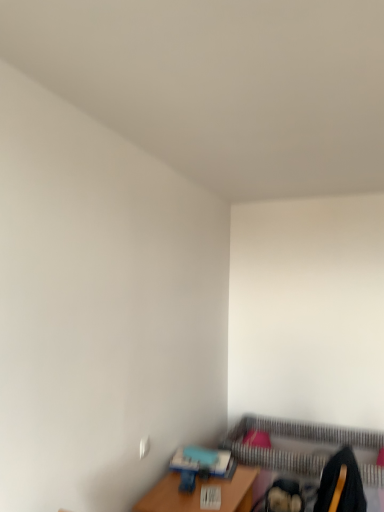
Question: Is wooden table at lower right shorter than striped fabric bed frame at lower right?

Choices:
 (A) no
 (B) yes

Answer: (B)

Question: Is wooden table at lower right next to striped fabric bed frame at lower right and touching it?

Choices:
 (A) no
 (B) yes

Answer: (A)

Question: Does wooden table at lower right have a larger size compared to striped fabric bed frame at lower right?

Choices:
 (A) yes
 (B) no

Answer: (B)

Question: Is wooden table at lower right outside striped fabric bed frame at lower right?

Choices:
 (A) yes
 (B) no

Answer: (A)

Question: Is wooden table at lower right taller than striped fabric bed frame at lower right?

Choices:
 (A) no
 (B) yes

Answer: (A)

Question: Would you say metallic gold swivel chair at lower right is to the left or to the right of wooden table at lower right in the picture?

Choices:
 (A) left
 (B) right

Answer: (B)

Question: From a real-world perspective, is metallic gold swivel chair at lower right physically located above or below wooden table at lower right?

Choices:
 (A) above
 (B) below

Answer: (A)

Question: Is metallic gold swivel chair at lower right inside or outside of wooden table at lower right?

Choices:
 (A) outside
 (B) inside

Answer: (A)

Question: From the image's perspective, is metallic gold swivel chair at lower right located above or below wooden table at lower right?

Choices:
 (A) above
 (B) below

Answer: (A)

Question: Based on their positions, is striped fabric bed frame at lower right located to the left or right of metallic gold swivel chair at lower right?

Choices:
 (A) right
 (B) left

Answer: (A)

Question: From the image's perspective, relative to metallic gold swivel chair at lower right, is striped fabric bed frame at lower right above or below?

Choices:
 (A) below
 (B) above

Answer: (A)

Question: Is striped fabric bed frame at lower right in front of or behind metallic gold swivel chair at lower right in the image?

Choices:
 (A) behind
 (B) front

Answer: (A)

Question: From a real-world perspective, is striped fabric bed frame at lower right positioned above or below metallic gold swivel chair at lower right?

Choices:
 (A) below
 (B) above

Answer: (A)

Question: Relative to metallic gold swivel chair at lower right, is wooden table at lower right in front or behind?

Choices:
 (A) behind
 (B) front

Answer: (A)

Question: From the image's perspective, relative to metallic gold swivel chair at lower right, is wooden table at lower right above or below?

Choices:
 (A) above
 (B) below

Answer: (B)